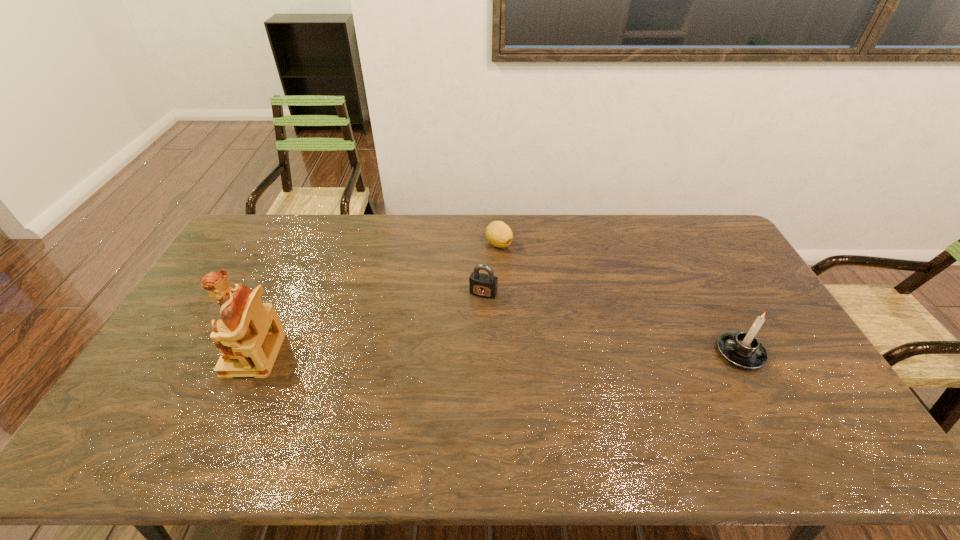
Find the location of a particular element. Image resolution: width=960 pixels, height=540 pixels. empty location between the third tallest object and the rightmost object is located at coordinates (612, 323).

Identify the location of empty location between the tallest object and the shortest object. (376, 299).

You are a GUI agent. You are given a task and a screenshot of the screen. Output one action in this format:
    pyautogui.click(x=<x>, y=<y>)
    Task: Click on the vacant point located between the second shortest object and the leftmost object
    Image resolution: width=960 pixels, height=540 pixels.
    Given the screenshot: What is the action you would take?
    pyautogui.click(x=369, y=323)

At what (x,y) coordinates should I click in order to perform the action: click on free space that is in between the tallest object and the farthest object. Please return your answer as a coordinate pair (x, y). This screenshot has width=960, height=540. Looking at the image, I should click on (376, 299).

Where is `free space between the third shortest object and the tallest object`? The image size is (960, 540). free space between the third shortest object and the tallest object is located at coordinates (497, 354).

I want to click on the closest object to the second shortest object, so click(x=499, y=234).

Locate which object ranks in proximity to the lemon. Please provide its 2D coordinates. Your answer should be formatted as a tuple, i.e. [(x, y)], where the tuple contains the x and y coordinates of a point satisfying the conditions above.

[(483, 285)]

Identify the location of free region that satisfies the following two spatial constraints: 1. on the front side of the farthest object; 2. with a handle on the side of the rightmost object. This screenshot has height=540, width=960. (504, 353).

At what (x,y) coordinates should I click in order to perform the action: click on free space in the image that satisfies the following two spatial constraints: 1. on the front side of the second farthest object; 2. with a handle on the side of the candle holder. Please return your answer as a coordinate pair (x, y). The width and height of the screenshot is (960, 540). Looking at the image, I should click on (484, 353).